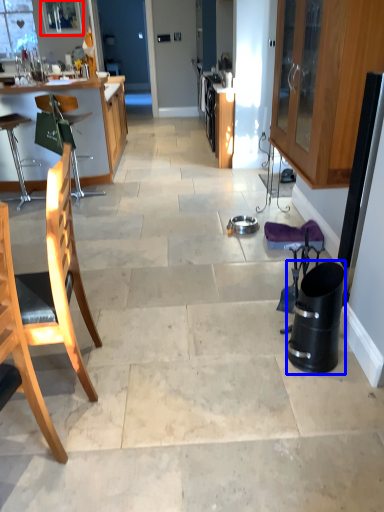
Question: Which object is further to the camera taking this photo, window screen (highlighted by a red box) or trash bin/can (highlighted by a blue box)?

Choices:
 (A) window screen
 (B) trash bin/can

Answer: (A)